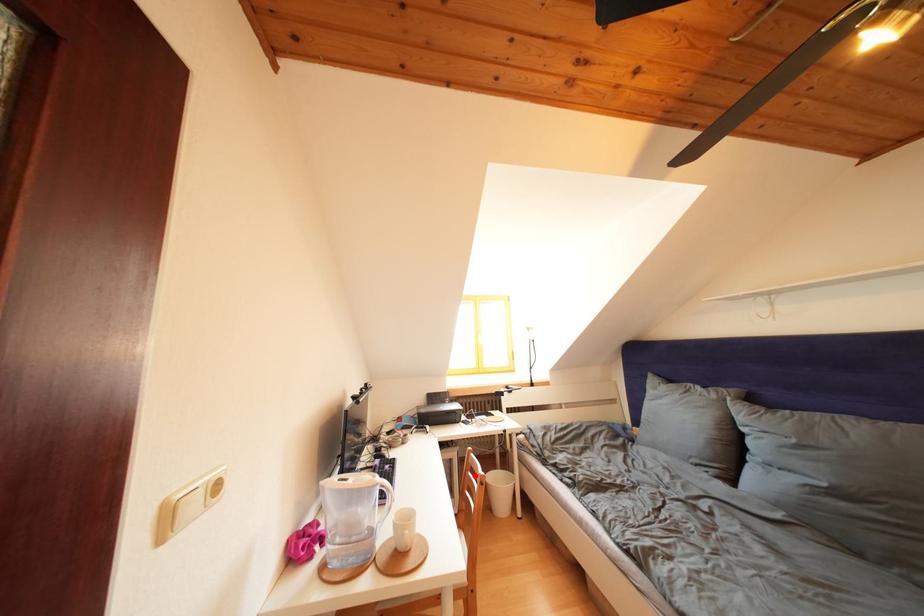
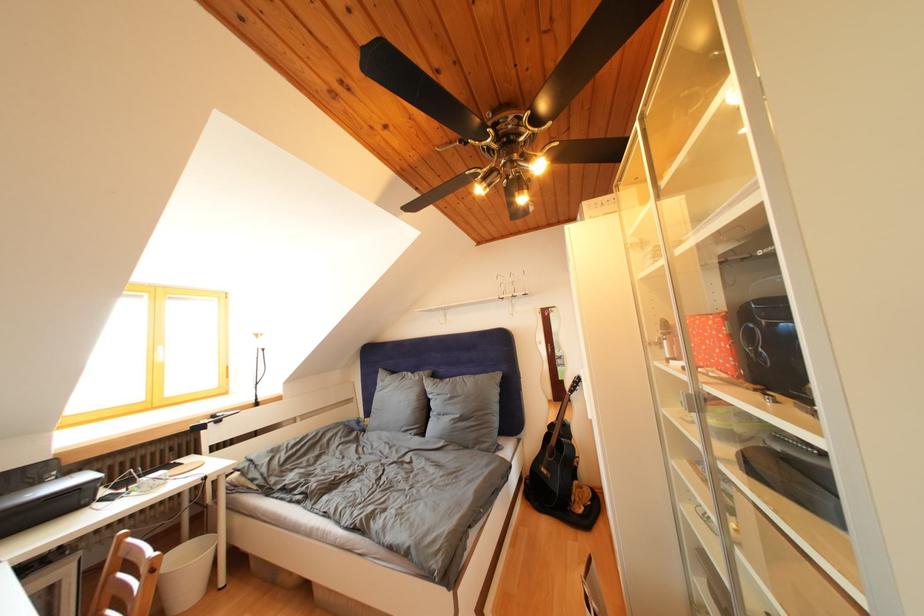
Question: I am providing you with two images of the same scene from different viewpoints. A red point is marked on the first image. At the location where the point appears in image 1, is it still visible in image 2?

Choices:
 (A) Yes
 (B) No

Answer: (A)